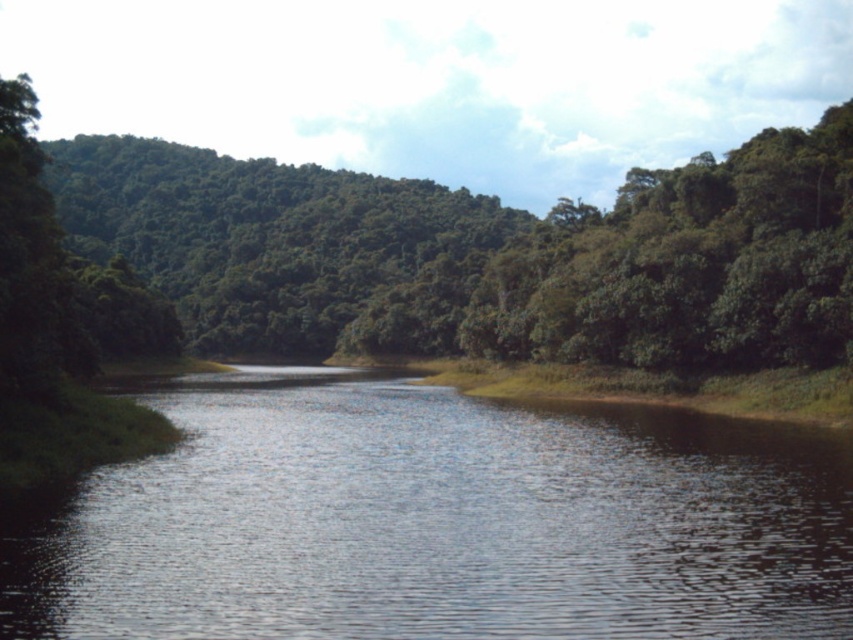
Looking at this image, you are standing on the grassy strip between the shiny dark water at center and the green leafy tree at center. If you look straight ahead, which object is directly in front of you?

The shiny dark water at center is directly in front of you because it is located below the green leafy tree at center, meaning the water is positioned lower in the scene.

You are standing at the edge of the scene and want to walk towards the shiny dark water at center and the green leafy tree at center. Which object will you encounter first?

You will encounter the shiny dark water at center first because it is closer to you than the green leafy tree at center.